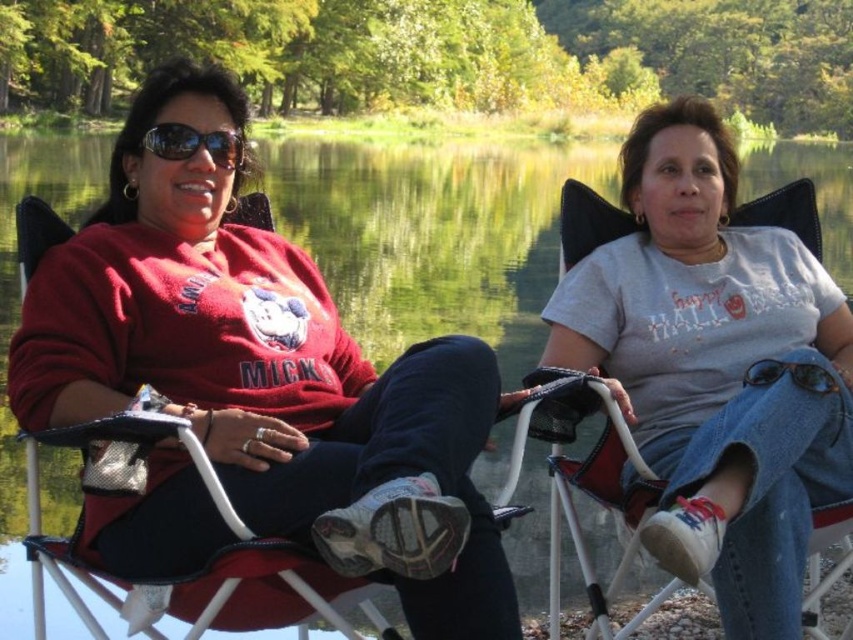
You are planning to take a photo of the matte red sweatshirt at left and the denim fabric chair at center. To ensure both are in the frame, should you adjust your camera upwards or downwards?

The matte red sweatshirt at left is located above the denim fabric chair at center, so to include both in the frame, you should adjust your camera downwards to capture the lower area where the denim fabric chair at center is positioned while still keeping the matte red sweatshirt at left visible.

What are the coordinates of the matte red sweatshirt at left?

The coordinates of the matte red sweatshirt at left are at point (265,371).